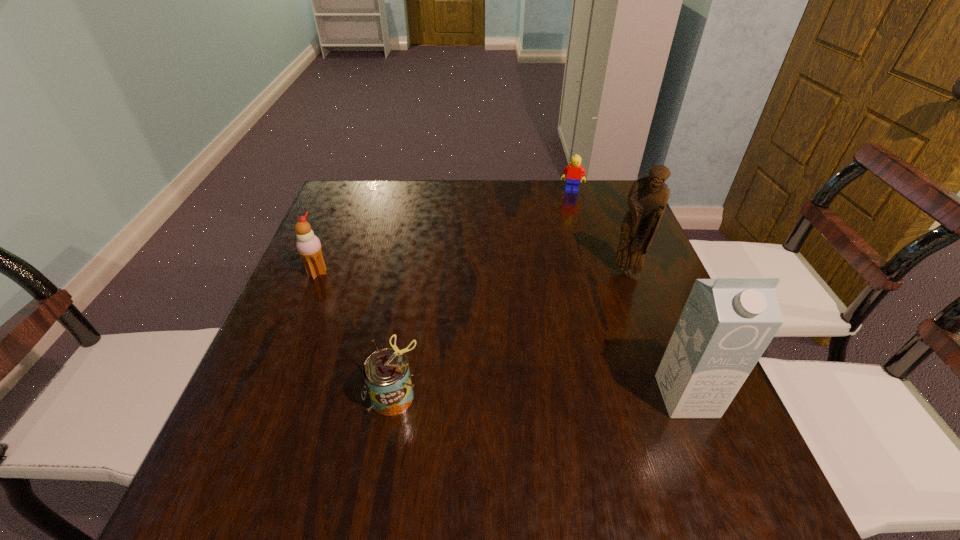
Identify the location of object that is at the left edge. (308, 245).

Locate an element on the screen. The height and width of the screenshot is (540, 960). carton present at the right edge is located at coordinates (727, 323).

Find the location of a particular element. The height and width of the screenshot is (540, 960). figurine located at the right edge is located at coordinates (647, 199).

The image size is (960, 540). Identify the location of Lego that is at the right edge. (572, 173).

Locate an element on the screen. The image size is (960, 540). object situated at the far right corner is located at coordinates pos(572,173).

Find the location of a particular element. This screenshot has width=960, height=540. object located in the near right corner section of the desktop is located at coordinates (727, 323).

Locate an element on the screen. The width and height of the screenshot is (960, 540). vacant space at the far edge is located at coordinates (383, 215).

In the image, there is a desktop. Identify the location of free space at the near edge. (567, 410).

You are a GUI agent. You are given a task and a screenshot of the screen. Output one action in this format:
    pyautogui.click(x=<x>, y=<y>)
    Task: Click on the free location at the left edge of the desktop
    The height and width of the screenshot is (540, 960).
    Given the screenshot: What is the action you would take?
    click(363, 237)

In order to click on vacant area at the right edge of the desktop in this screenshot , I will do click(656, 353).